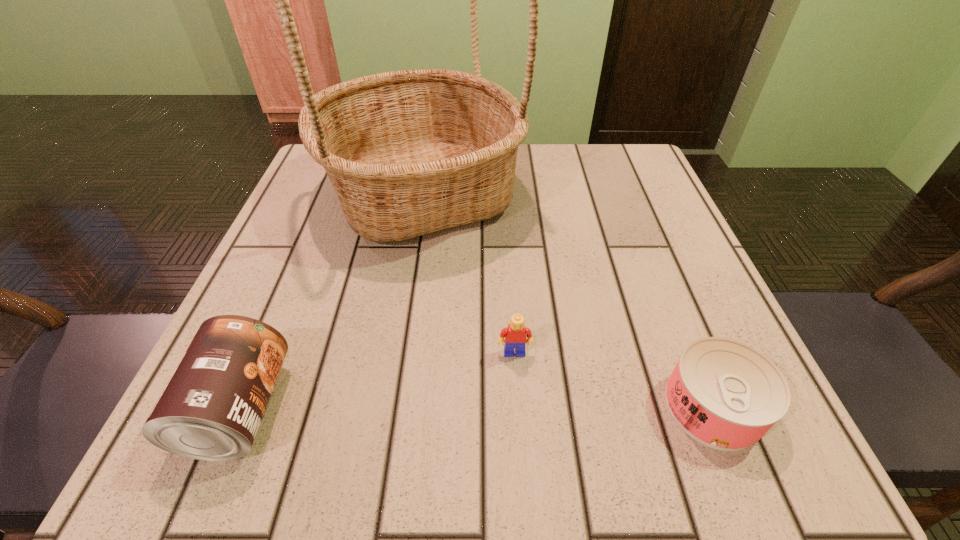
Where is `the farthest object`? This screenshot has width=960, height=540. the farthest object is located at coordinates (411, 152).

Locate an element on the screen. basket is located at coordinates (411, 152).

This screenshot has width=960, height=540. I want to click on the taller can, so click(211, 409).

Locate an element on the screen. the left can is located at coordinates (211, 409).

Identify the location of Lego. (515, 334).

Find the location of a particular element. This screenshot has width=960, height=540. the third tallest object is located at coordinates (515, 334).

Where is `the shorter can`? This screenshot has height=540, width=960. the shorter can is located at coordinates (725, 394).

You are a GUI agent. You are given a task and a screenshot of the screen. Output one action in this format:
    pyautogui.click(x=<x>, y=<y>)
    Task: Click on the rightmost object
    
    Given the screenshot: What is the action you would take?
    pyautogui.click(x=725, y=394)

In order to click on vacant area located 0.220m on the right of the basket in this screenshot , I will do `click(627, 193)`.

At what (x,y) coordinates should I click in order to perform the action: click on vacant space located 0.350m on the front label of the taller can. Please return your answer as a coordinate pair (x, y). The image size is (960, 540). Looking at the image, I should click on (549, 409).